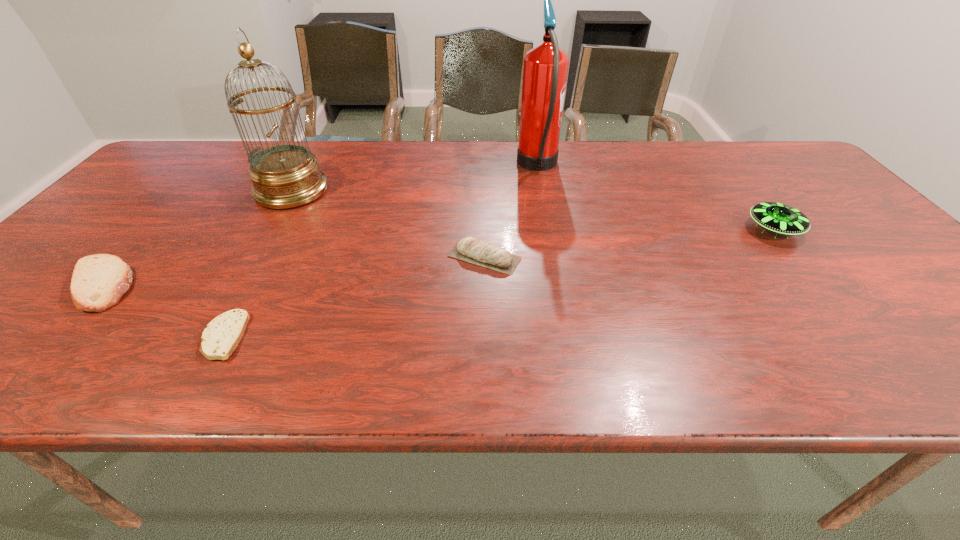
The image size is (960, 540). Identify the location of unoccupied position between the rightmost object and the rightmost pita bread. (629, 243).

The image size is (960, 540). Identify the location of free space between the second shortest object and the second pita bread from right to left. (162, 310).

I want to click on blank region between the birdcage and the rightmost object, so click(x=533, y=210).

The image size is (960, 540). Find the location of `object identified as the fifth closest to the shortest object`. object identified as the fifth closest to the shortest object is located at coordinates (780, 218).

Identify the location of the third closest object relative to the fire extinguisher. (284, 176).

Choose which pita bread is the nearest neighbor to the second shortest object. Please provide its 2D coordinates. Your answer should be formatted as a tuple, i.e. [(x, y)], where the tuple contains the x and y coordinates of a point satisfying the conditions above.

[(221, 336)]

The width and height of the screenshot is (960, 540). Find the location of `pita bread that can be found as the closest to the shortest pita bread`. pita bread that can be found as the closest to the shortest pita bread is located at coordinates (98, 282).

Find the location of a particular element. Image resolution: width=960 pixels, height=540 pixels. free location that satisfies the following two spatial constraints: 1. on the back side of the shortest object; 2. on the right side of the rightmost pita bread is located at coordinates (267, 257).

Identify the location of free space that satisfies the following two spatial constraints: 1. with an open door on the rightmost object; 2. on the left side of the birdcage. (269, 229).

The width and height of the screenshot is (960, 540). In order to click on vacant space that satisfies the following two spatial constraints: 1. on the front side of the fire extinguisher; 2. with an open door on the birdcage in this screenshot , I will do `click(542, 191)`.